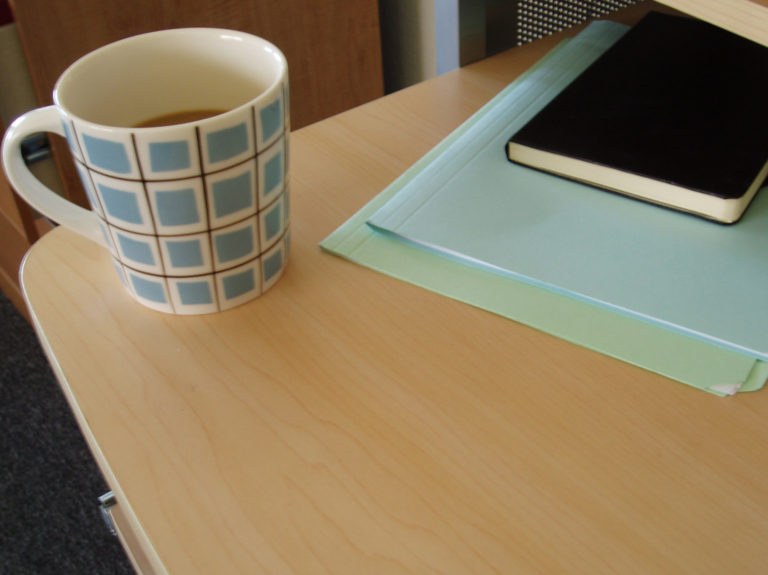
You are a GUI agent. You are given a task and a screenshot of the screen. Output one action in this format:
    pyautogui.click(x=<x>, y=<y>)
    Task: Click on the cup handle
    
    Given the screenshot: What is the action you would take?
    pyautogui.click(x=44, y=114)